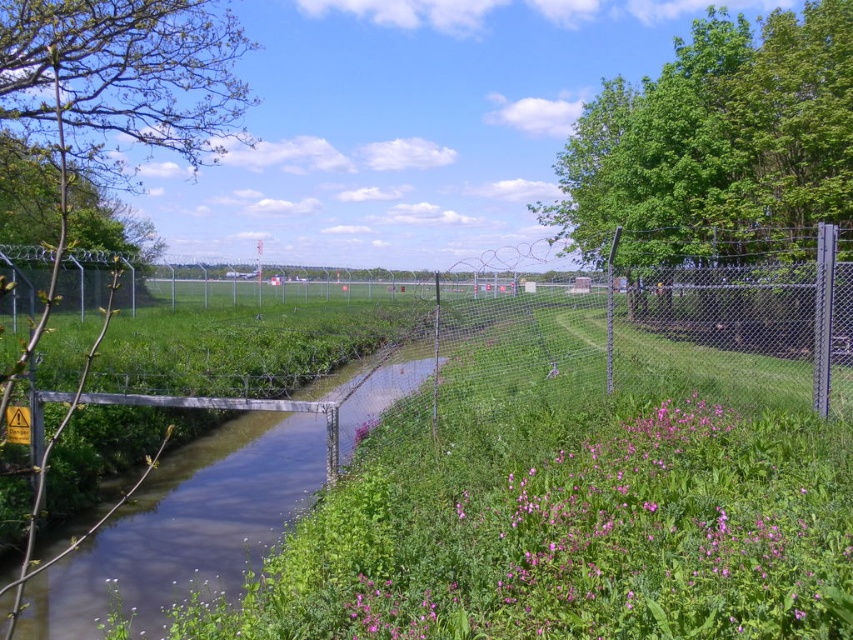
You are a landscape architect designing a walking path between the green leafy tree at upper right and the green leafy tree at left. The path must be at least 15 meters long to accommodate a scenic walk. Can the path be designed to meet this requirement based on their current positions?

The green leafy tree at upper right is 15.10 meters from the green leafy tree at left, so yes, the path can be designed to meet the requirement since the distance between them is just over 15 meters.

You are standing at the origin point of the image coordinate system. Where is the green leafy tree at upper right located in terms of its 2D coordinates?

The green leafy tree at upper right is located at the 2D coordinates of point [717,144].

You are standing at the center of the water channel and want to walk towards the green leafy tree at left. Which direction should you walk to avoid passing in front of the green leafy tree at upper right?

You should walk towards the green leafy tree at left while moving to the left side of the channel. This way, you will stay behind the green leafy tree at upper right and avoid passing in front of it since the green leafy tree at left is behind the green leafy tree at upper right.